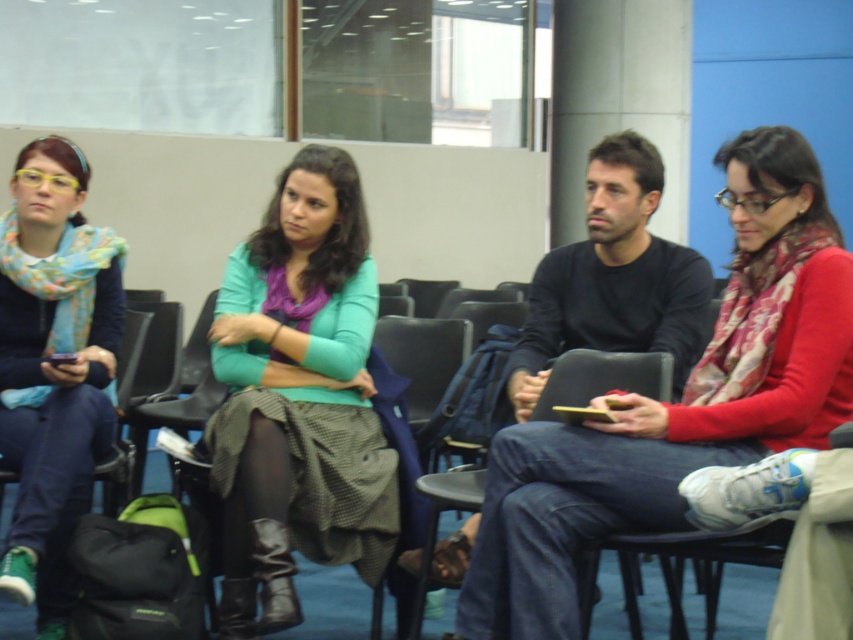
You are a person who needs to pass between the two women sitting on the teal sweater at center and the woman with glasses and colorful scarf to your left. The path between them is 2.45 meters wide. If you are 1.8 meters tall, will you be able to walk through without bending down?

The path between the two women is 2.45 meters wide, which is wider than your height of 1.8 meters. Therefore, you can walk through without bending down.

You are an interior designer analyzing the seating area. You need to determine the vertical positioning of the matte blue scarf at left and the black matte sweater at center. Which one is positioned lower in the image?

The matte blue scarf at left is located below the black matte sweater at center, so the matte blue scarf at left is positioned lower in the image.

Please look at the scene and identify the coordinates of the matte blue scarf at left. What are its coordinates?

The coordinates of the matte blue scarf at left are at point (53, 365).